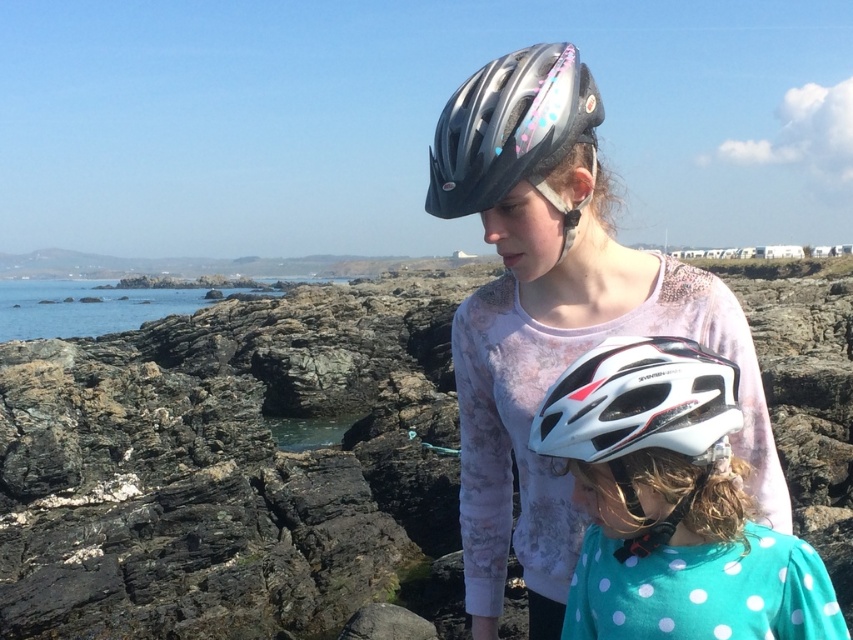
You are a photographer trying to capture the rough textured rocks at center and the white matte bicycle helmet at center in a single frame. Based on their sizes, will you need to adjust your camera to include both objects without cropping?

The rough textured rocks at center might be wider than white matte bicycle helmet at center, so you might need to adjust your camera to include both objects without cropping.

You are a photographer trying to capture the white matte bicycle helmet at center in your shot. Based on its coordinates, where should you aim your camera?

The white matte bicycle helmet at center is located at coordinates point (640, 403), so aim your camera at that point to capture it.